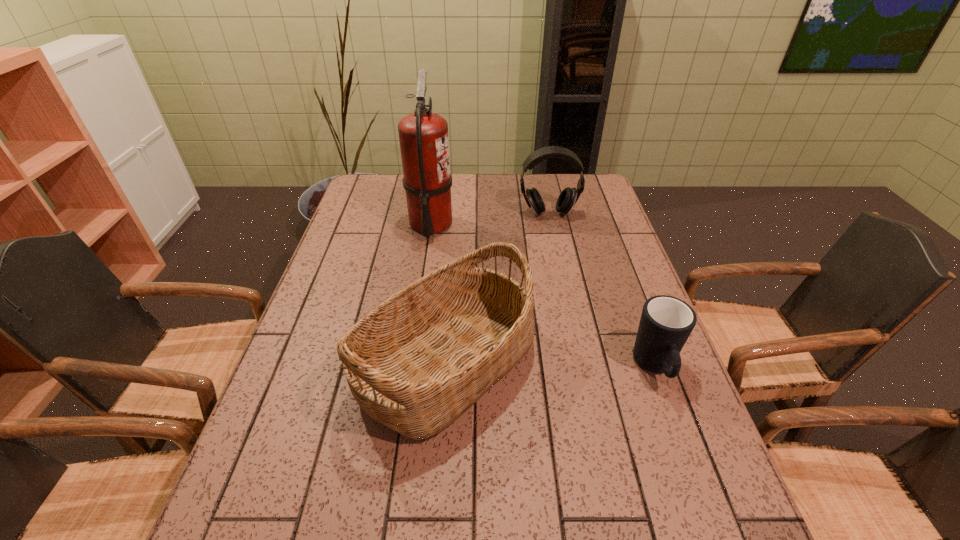
Image resolution: width=960 pixels, height=540 pixels. Identify the location of earphone situated at the right edge. pyautogui.click(x=568, y=197).

This screenshot has width=960, height=540. What are the coordinates of `mug that is at the right edge` in the screenshot? It's located at (666, 322).

Where is `blank space at the far edge of the desktop`? This screenshot has height=540, width=960. blank space at the far edge of the desktop is located at coordinates (461, 206).

The width and height of the screenshot is (960, 540). In the image, there is a desktop. What are the coordinates of `free space at the left edge` in the screenshot? It's located at (302, 509).

At what (x,y) coordinates should I click in order to perform the action: click on vacant space at the right edge of the desktop. Please return your answer as a coordinate pair (x, y). The width and height of the screenshot is (960, 540). Looking at the image, I should click on [567, 218].

Identify the location of free spot at the far left corner of the desktop. Image resolution: width=960 pixels, height=540 pixels. coord(364,184).

This screenshot has width=960, height=540. Identify the location of vacant space at the far right corner of the desktop. (598, 197).

The image size is (960, 540). In order to click on vacant region between the shortest object and the earphone in this screenshot , I will do `click(602, 291)`.

Locate an element on the screen. free space between the fire extinguisher and the shortest object is located at coordinates (543, 296).

Find the location of a particular element. The width and height of the screenshot is (960, 540). unoccupied position between the third object from left to right and the fire extinguisher is located at coordinates (490, 219).